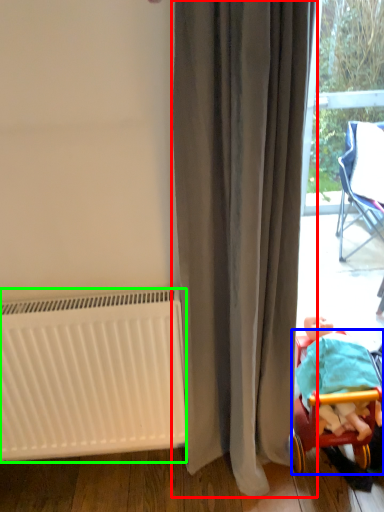
Question: Based on their relative distances, which object is farther from curtain (highlighted by a red box)? Choose from furniture (highlighted by a blue box) and radiator (highlighted by a green box).

Choices:
 (A) furniture
 (B) radiator

Answer: (A)